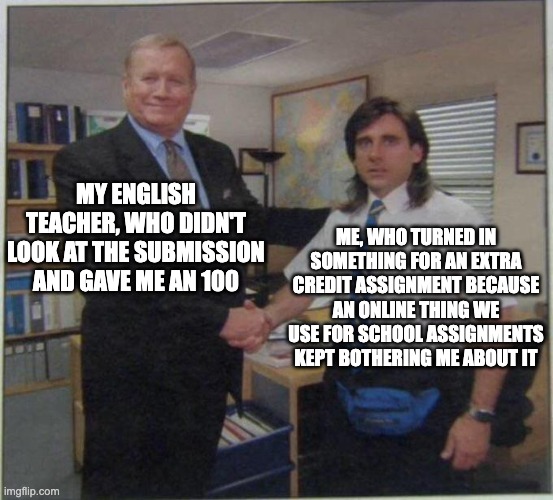
What are the coordinates of `windowblinds` in the screenshot? It's located at (474, 150).